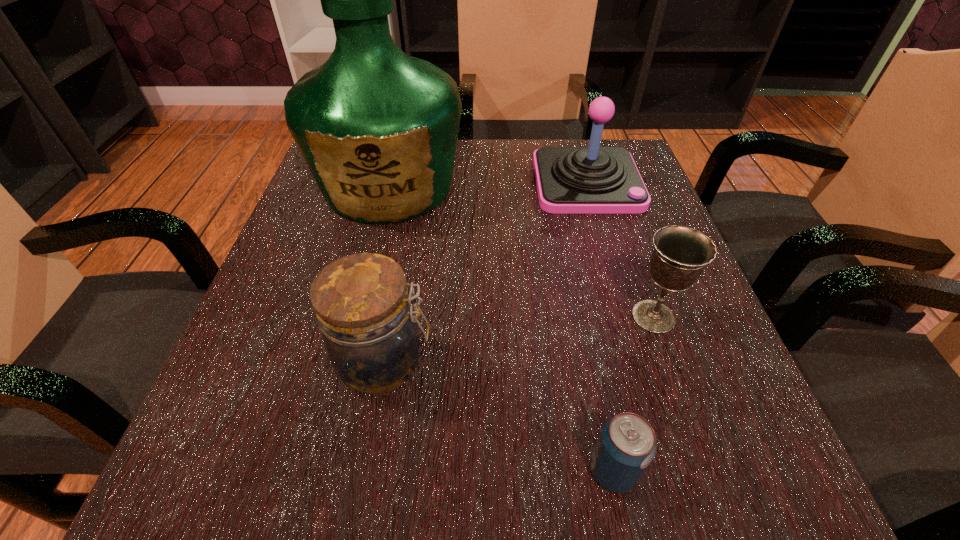
Where is `free space that satisfies the following two spatial constraints: 1. forward from the base of the joystick; 2. on the lid of the jar`? This screenshot has height=540, width=960. free space that satisfies the following two spatial constraints: 1. forward from the base of the joystick; 2. on the lid of the jar is located at coordinates (639, 362).

This screenshot has width=960, height=540. What are the coordinates of `blank space that satisfies the following two spatial constraints: 1. forward from the base of the joystick; 2. on the left side of the chalice` in the screenshot? It's located at (627, 316).